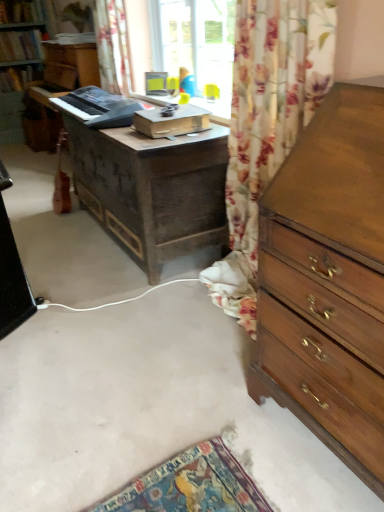
Question: Is wooden chest of drawers at right completely or partially inside floral fabric curtain at upper center?

Choices:
 (A) yes
 (B) no

Answer: (B)

Question: Does floral fabric curtain at upper center appear on the right side of wooden chest of drawers at right?

Choices:
 (A) no
 (B) yes

Answer: (A)

Question: From a real-world perspective, is floral fabric curtain at upper center on wooden chest of drawers at right?

Choices:
 (A) no
 (B) yes

Answer: (B)

Question: Does floral fabric curtain at upper center lie in front of wooden chest of drawers at right?

Choices:
 (A) yes
 (B) no

Answer: (B)

Question: Is floral fabric curtain at upper center bigger than wooden chest of drawers at right?

Choices:
 (A) no
 (B) yes

Answer: (A)

Question: Is floral fabric curtain at upper center facing towards wooden chest of drawers at right?

Choices:
 (A) yes
 (B) no

Answer: (B)

Question: Is floral fabric curtain at upper center not near dark brown wooden desk at center?

Choices:
 (A) yes
 (B) no

Answer: (A)

Question: Would you say floral fabric curtain at upper center is outside dark brown wooden desk at center?

Choices:
 (A) no
 (B) yes

Answer: (B)

Question: From a real-world perspective, is floral fabric curtain at upper center physically above dark brown wooden desk at center?

Choices:
 (A) no
 (B) yes

Answer: (B)

Question: Is the depth of floral fabric curtain at upper center greater than that of dark brown wooden desk at center?

Choices:
 (A) yes
 (B) no

Answer: (A)

Question: Does floral fabric curtain at upper center appear on the right side of dark brown wooden desk at center?

Choices:
 (A) no
 (B) yes

Answer: (A)

Question: Is floral fabric curtain at upper center positioned in front of dark brown wooden desk at center?

Choices:
 (A) no
 (B) yes

Answer: (A)

Question: From a real-world perspective, does black plastic keyboard at center sit lower than dark brown wooden desk at center?

Choices:
 (A) no
 (B) yes

Answer: (A)